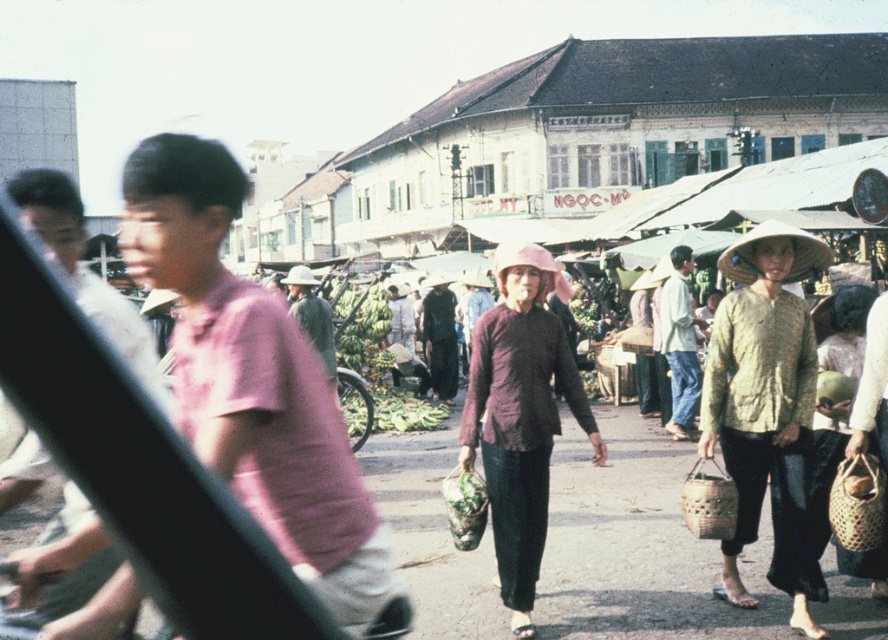
Question: Is textured yellow blouse at center positioned before matte purple blouse at center?

Choices:
 (A) yes
 (B) no

Answer: (A)

Question: Which object appears farthest from the camera in this image?

Choices:
 (A) matte purple blouse at center
 (B) textured yellow blouse at center
 (C) pink matte shirt at center

Answer: (A)

Question: Which of these objects is positioned farthest from the pink matte shirt at center?

Choices:
 (A) textured yellow blouse at center
 (B) matte purple blouse at center

Answer: (A)

Question: Can you confirm if textured yellow blouse at center is positioned to the right of matte purple blouse at center?

Choices:
 (A) yes
 (B) no

Answer: (A)

Question: Which of the following is the closest to the observer?

Choices:
 (A) matte purple blouse at center
 (B) textured yellow blouse at center
 (C) pink matte shirt at center

Answer: (C)

Question: Where is pink matte shirt at center located in relation to textured yellow blouse at center in the image?

Choices:
 (A) above
 (B) below

Answer: (A)